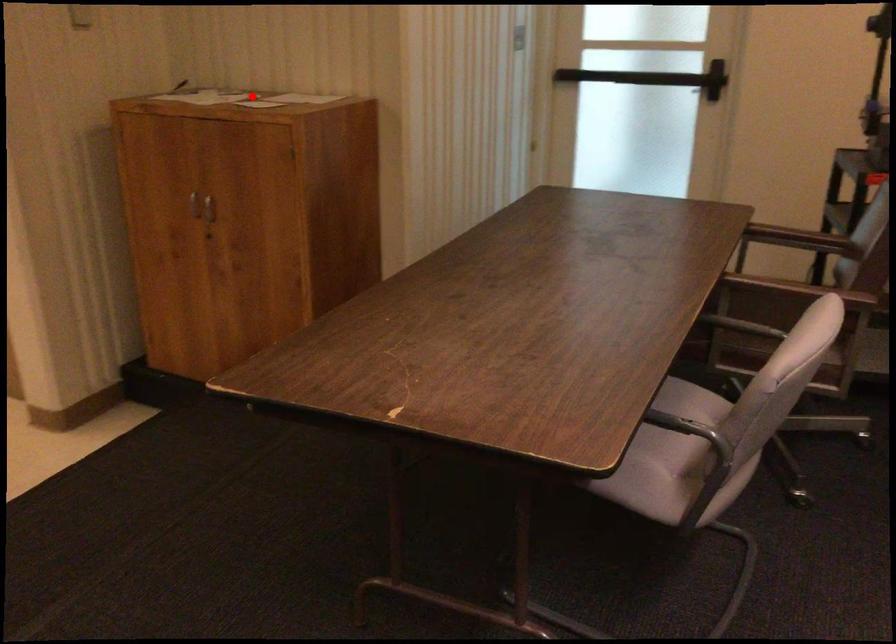
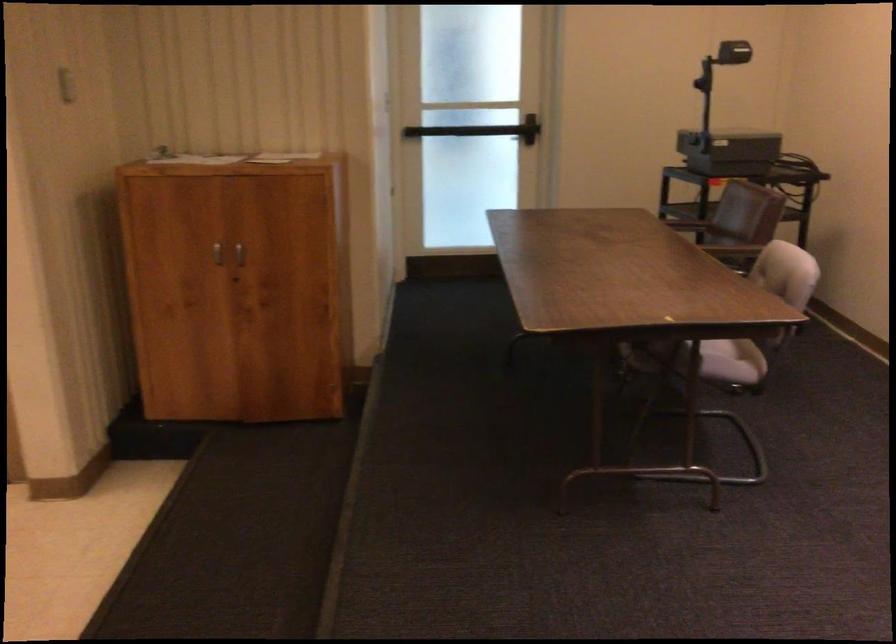
Find the pixel in the second image that matches the highlighted location in the first image.

(227, 158)